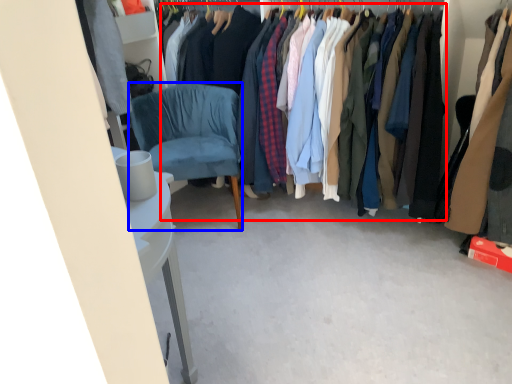
Question: Which of the following is the closest to the observer, clothing (highlighted by a red box) or chair (highlighted by a blue box)?

Choices:
 (A) clothing
 (B) chair

Answer: (A)